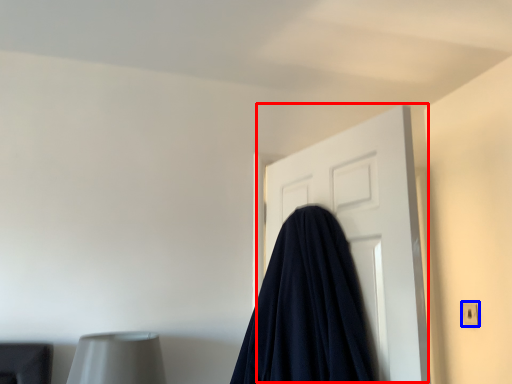
Question: Which object appears farthest to the camera in this image, door (highlighted by a red box) or electric outlet (highlighted by a blue box)?

Choices:
 (A) door
 (B) electric outlet

Answer: (B)